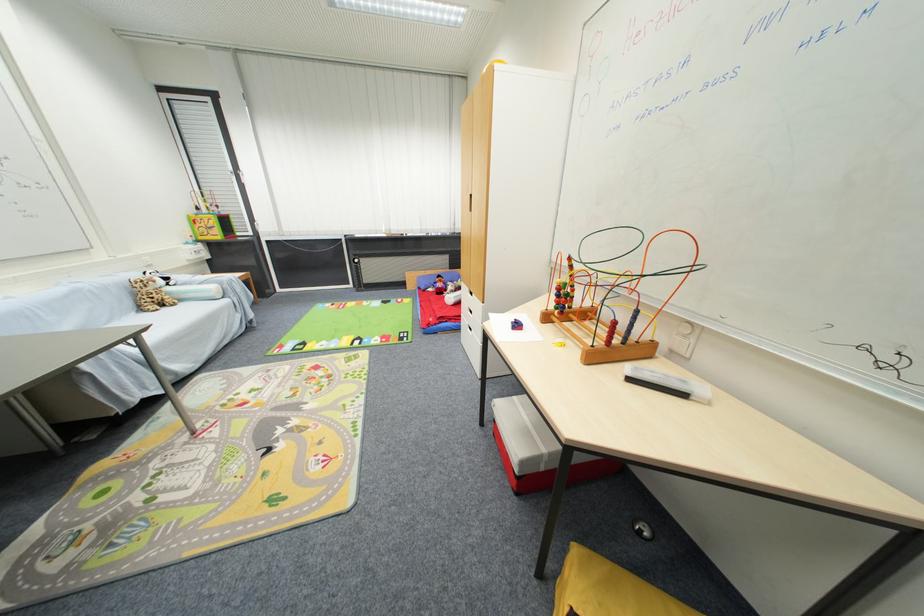
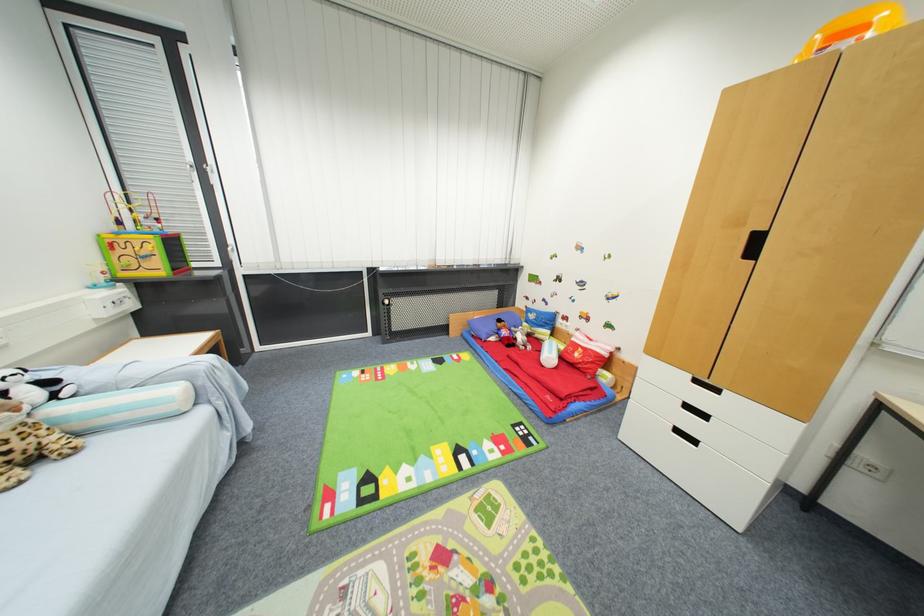
The point at (428, 290) is marked in the first image. Where is the corresponding point in the second image?

(488, 339)